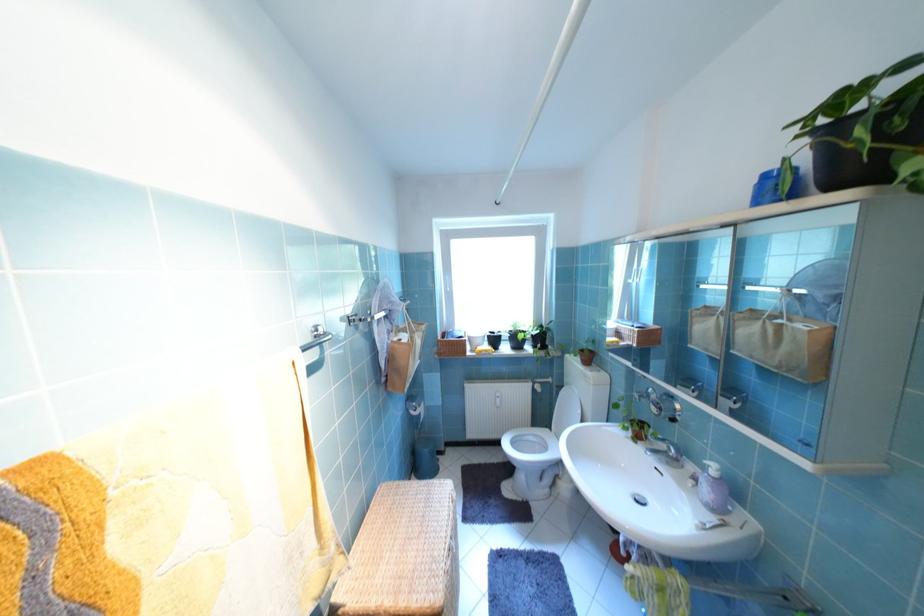
This screenshot has height=616, width=924. In order to click on white toilet lid in this screenshot , I will do `click(565, 410)`.